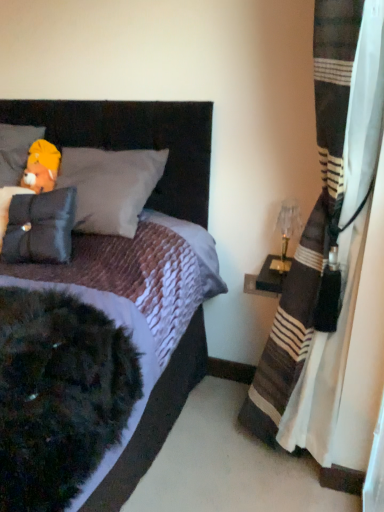
Where is `vacant region to the left of striped fabric curtain at right`? The height and width of the screenshot is (512, 384). vacant region to the left of striped fabric curtain at right is located at coordinates (190, 460).